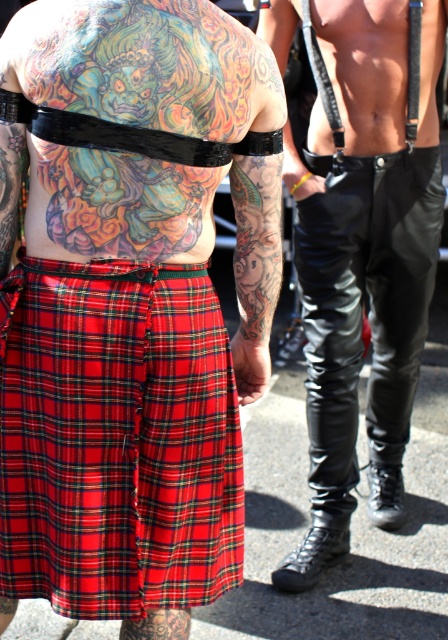
What do you see at coordinates (130, 301) in the screenshot?
I see `red plaid kilt at center` at bounding box center [130, 301].

Consider the image. Who is positioned more to the right, red plaid kilt at center or red plaid kilt at lower left?

From the viewer's perspective, red plaid kilt at center appears more on the right side.

Is point (154, 19) behind point (21, 417)?

That is False.

Where is `red plaid kilt at center`? Image resolution: width=448 pixels, height=640 pixels. red plaid kilt at center is located at coordinates (130, 301).

From the picture: Which of these two, red plaid kilt at lower left or black leather pants at center, stands taller?

With more height is black leather pants at center.

Does point (60, 592) lie in front of point (331, 44)?

Yes, it is in front of point (331, 44).

The width and height of the screenshot is (448, 640). In order to click on red plaid kilt at lower left in this screenshot , I will do `click(116, 440)`.

Who is shorter, red plaid kilt at center or black leather pants at center?

With less height is red plaid kilt at center.

The width and height of the screenshot is (448, 640). Describe the element at coordinates (130, 301) in the screenshot. I see `red plaid kilt at center` at that location.

Where is `red plaid kilt at center`? red plaid kilt at center is located at coordinates (130, 301).